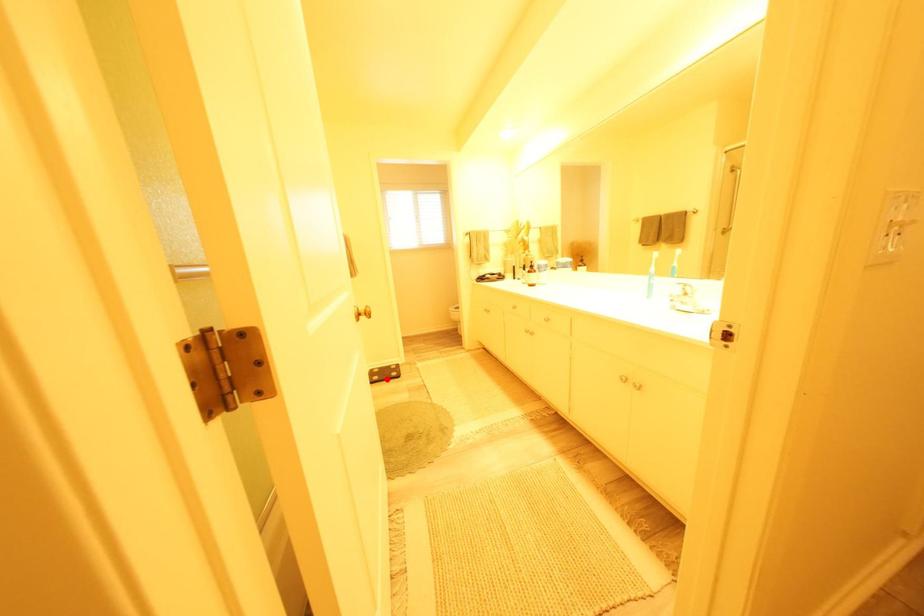
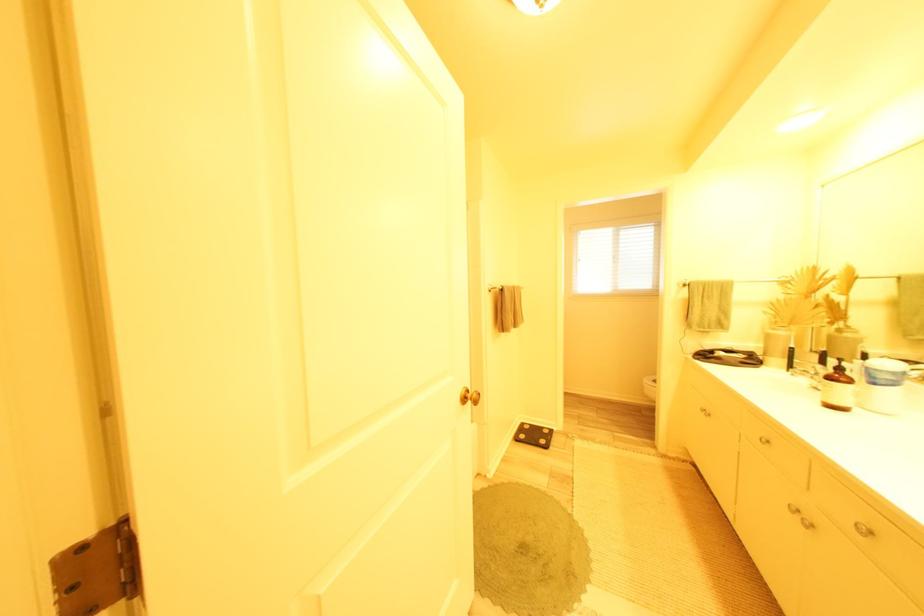
Locate, in the second image, the point that corresponds to the highlighted location in the first image.

(532, 438)